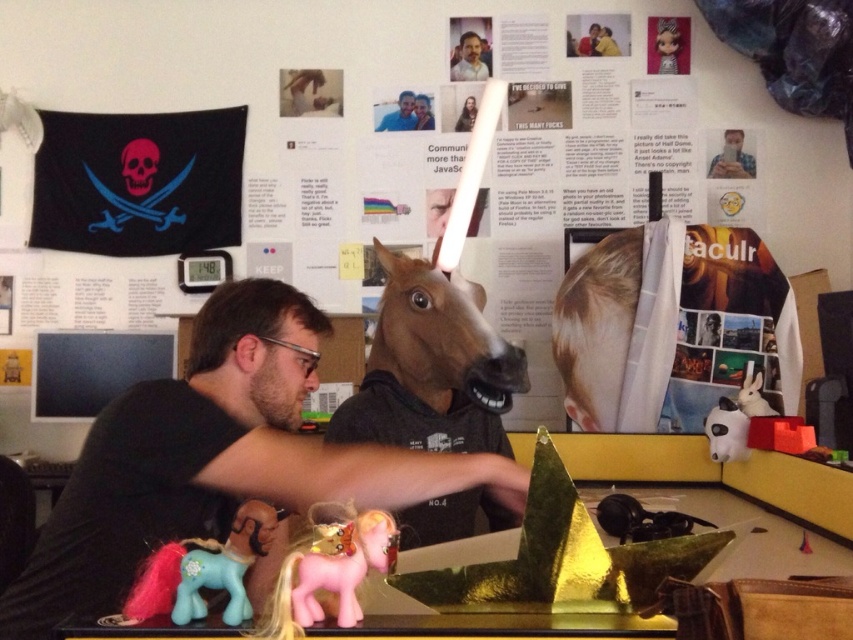
Question: Is white matte man at upper center below matte black shirt at center?

Choices:
 (A) yes
 (B) no

Answer: (B)

Question: Does pink plastic toy horse at lower center appear under matte black shirt at center?

Choices:
 (A) yes
 (B) no

Answer: (A)

Question: In this image, where is pastel pink plastic pony at lower left located relative to matte black horse head at center?

Choices:
 (A) above
 (B) below

Answer: (B)

Question: Which point is closer to the camera?

Choices:
 (A) (151, 584)
 (B) (751, 168)
 (C) (405, 100)

Answer: (A)

Question: Which point is closer to the camera?

Choices:
 (A) brown matte horse head at center
 (B) pink plastic toy horse at lower left
 (C) matte black horse mask at upper center

Answer: (B)

Question: Which of these objects is positioned farthest from the brown matte horse head at center?

Choices:
 (A) matte black horse mask at upper center
 (B) pink plastic toy horse at lower left
 (C) white matte man at upper center

Answer: (A)